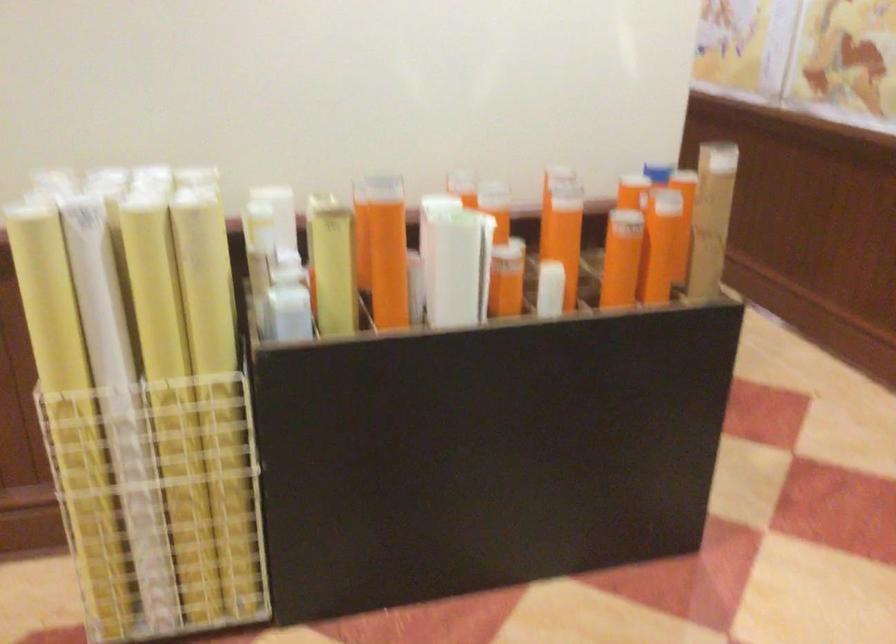
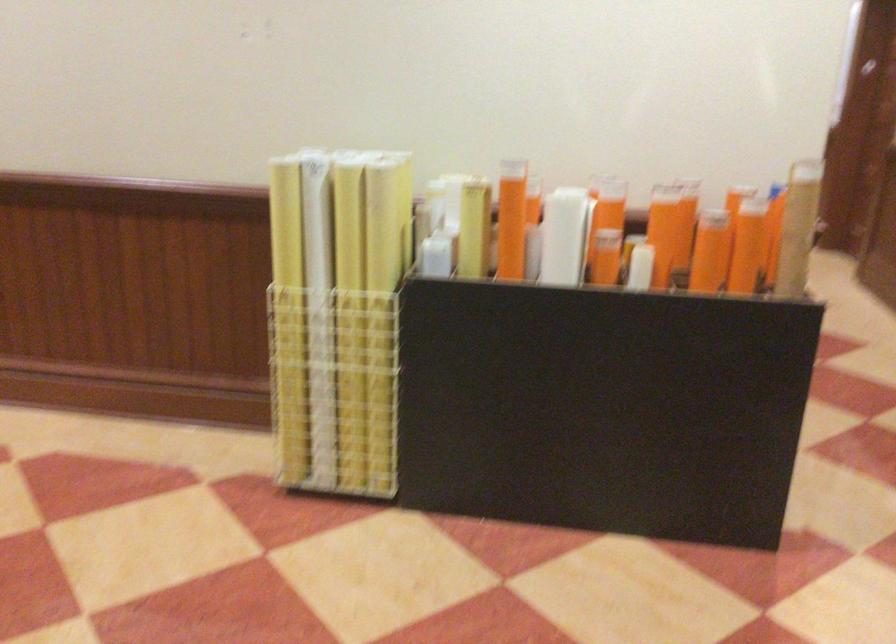
Locate, in the second image, the point that corresponds to (x=177, y=412) in the first image.

(350, 315)